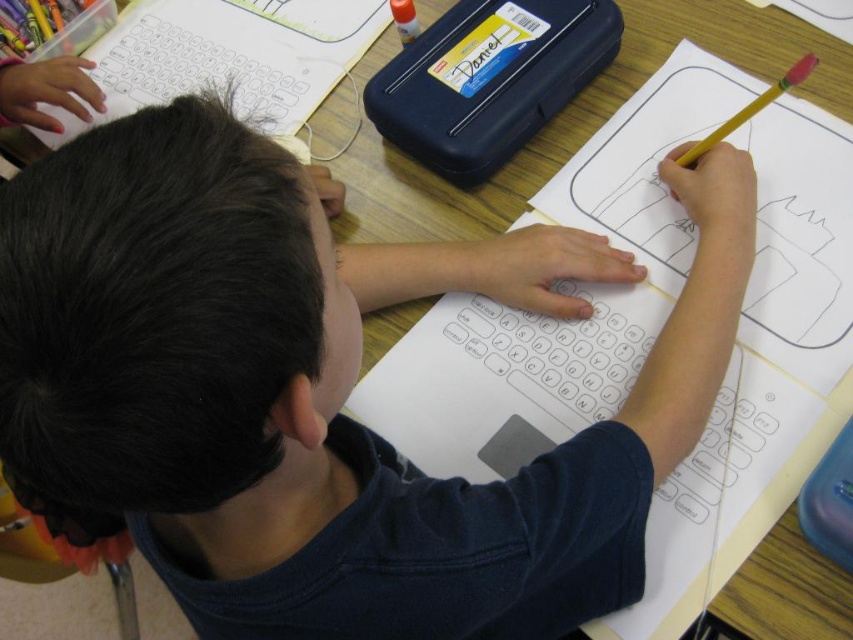
Based on the photo, which is below, yellow plastic nameplate at upper center or yellow wood pencil at upper right?

Positioned lower is yellow wood pencil at upper right.

What are the coordinates of `yellow plastic nameplate at upper center` in the screenshot? It's located at (479, 56).

Where is `yellow plastic nameplate at upper center`? The image size is (853, 640). yellow plastic nameplate at upper center is located at coordinates (479, 56).